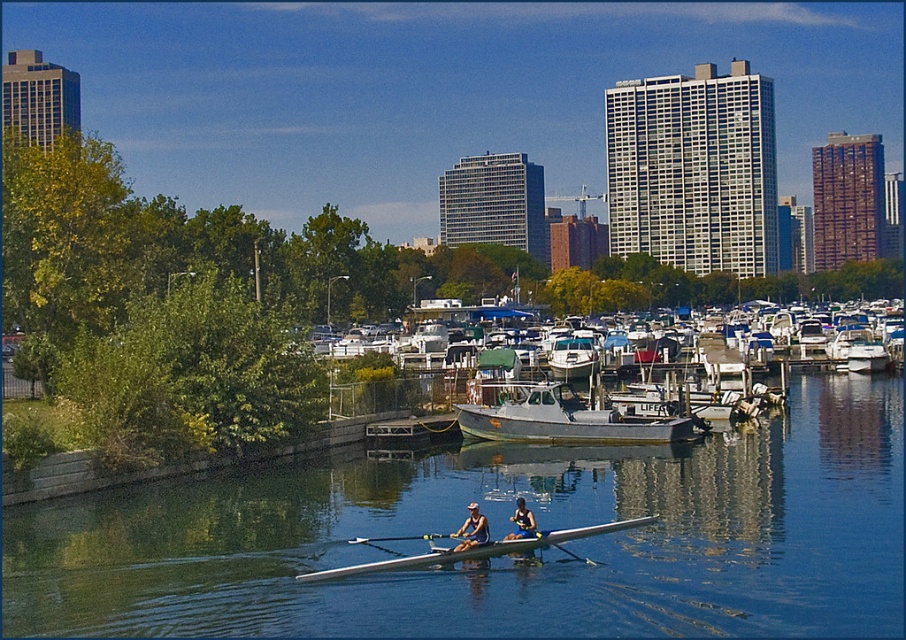
You are a photographer trying to capture the blue fabric rower at center in your shot. The camera you are using has a focal length of 50mm. Based on the coordinates provided, can you determine if the rower is positioned within the central 30x30 pixel area of the image frame?

The blue fabric rower at center is located at coordinates point (522,522), which is outside the central 30x30 pixel area of the image frame.

You are a photographer positioned at the center of the boat. You want to take a photo of both the smooth white oar at center and the smooth white paddle at center. Which object should you adjust your camera to focus on first if you want to capture them from left to right?

You should focus on the smooth white paddle at center first because it is positioned to the left of the smooth white oar at center.

You are a photographer positioned at the point with coordinates [471,529] in the image. What object are you directly facing?

The point at [471,529] corresponds to the matte blue rower at center, so you are directly facing the matte blue rower at center.